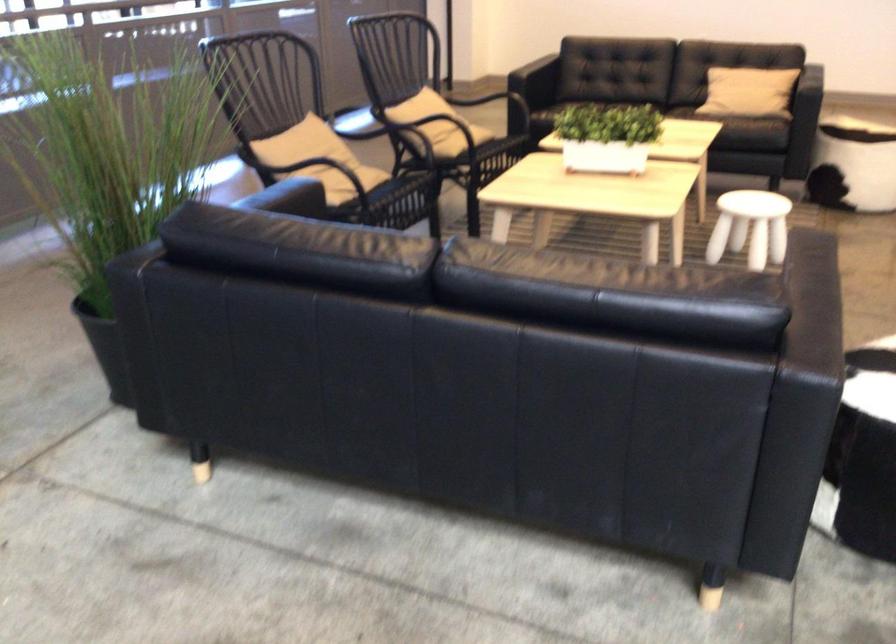
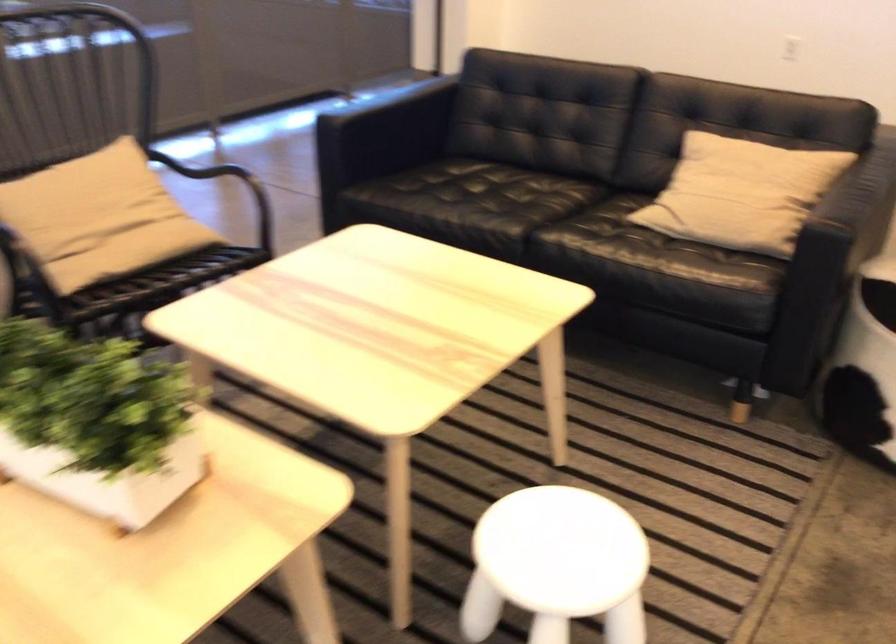
The point at (771,205) is marked in the first image. Where is the corresponding point in the second image?

(556, 565)